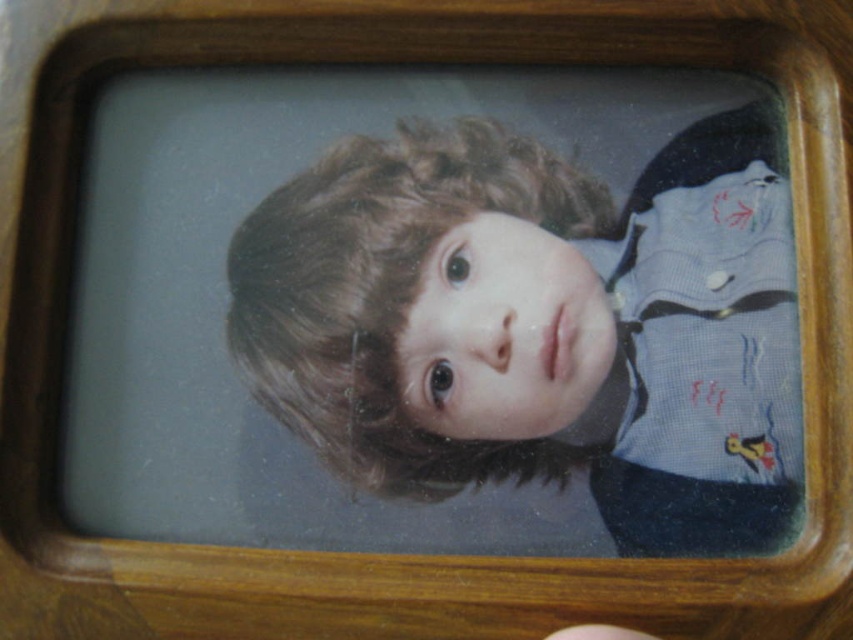
Question: Is smooth blue shirt at center below brown leather hand at lower center?

Choices:
 (A) yes
 (B) no

Answer: (B)

Question: Which point appears farthest from the camera in this image?

Choices:
 (A) (502, 349)
 (B) (749, 134)

Answer: (B)

Question: Can you confirm if smooth blue shirt at center is positioned to the left of smooth skin face at center?

Choices:
 (A) yes
 (B) no

Answer: (B)

Question: Which of the following is the closest to the observer?

Choices:
 (A) brown leather hand at lower center
 (B) smooth skin face at center

Answer: (A)

Question: Can you confirm if smooth blue shirt at center is thinner than brown leather hand at lower center?

Choices:
 (A) yes
 (B) no

Answer: (B)

Question: Which of the following is the farthest from the observer?

Choices:
 (A) smooth blue shirt at center
 (B) smooth skin face at center
 (C) brown leather hand at lower center

Answer: (B)